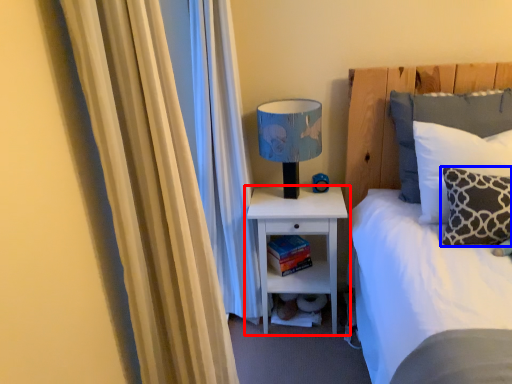
Question: Among these objects, which one is nearest to the camera, nightstand (highlighted by a red box) or pillow (highlighted by a blue box)?

Choices:
 (A) nightstand
 (B) pillow

Answer: (B)